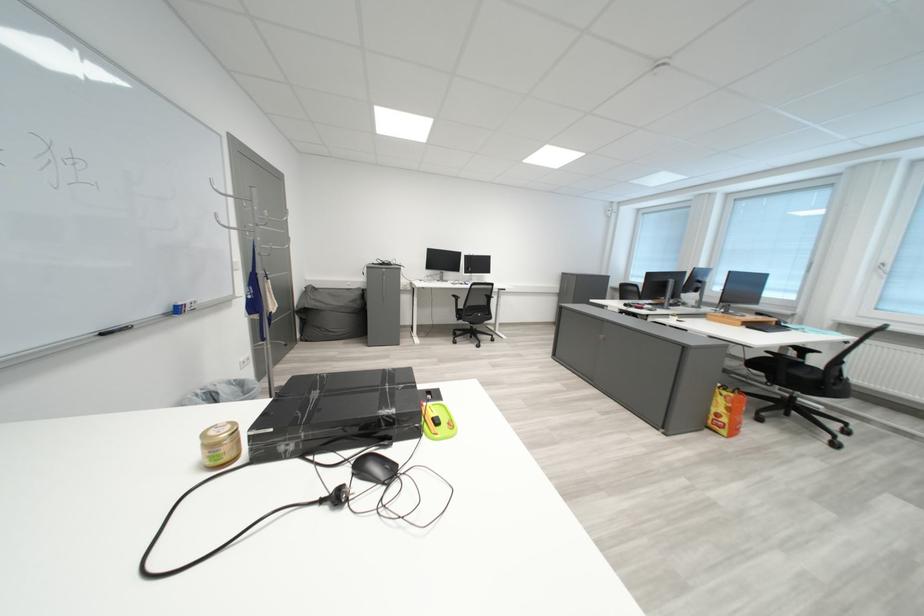
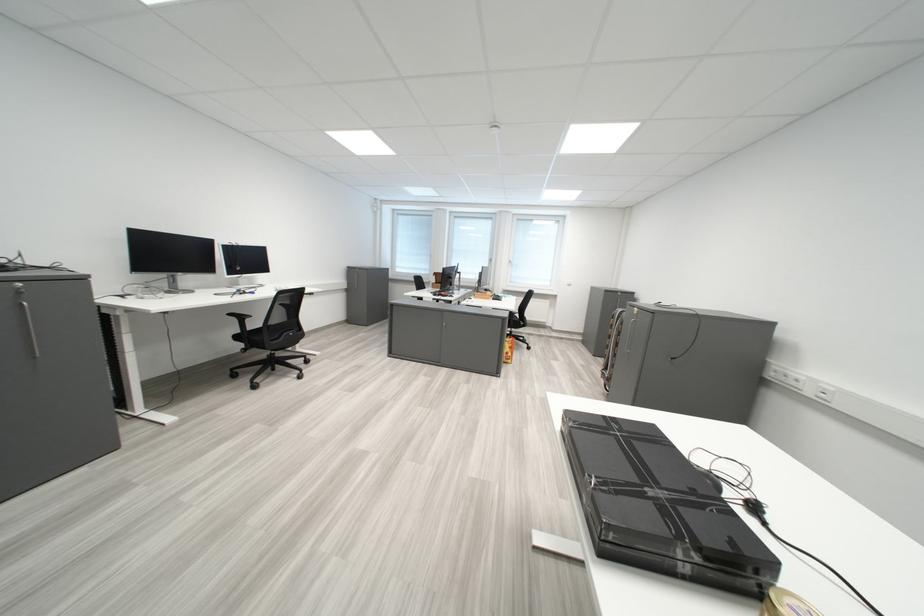
In the second image, find the point that corresponds to point 467,298 in the first image.

(244, 317)